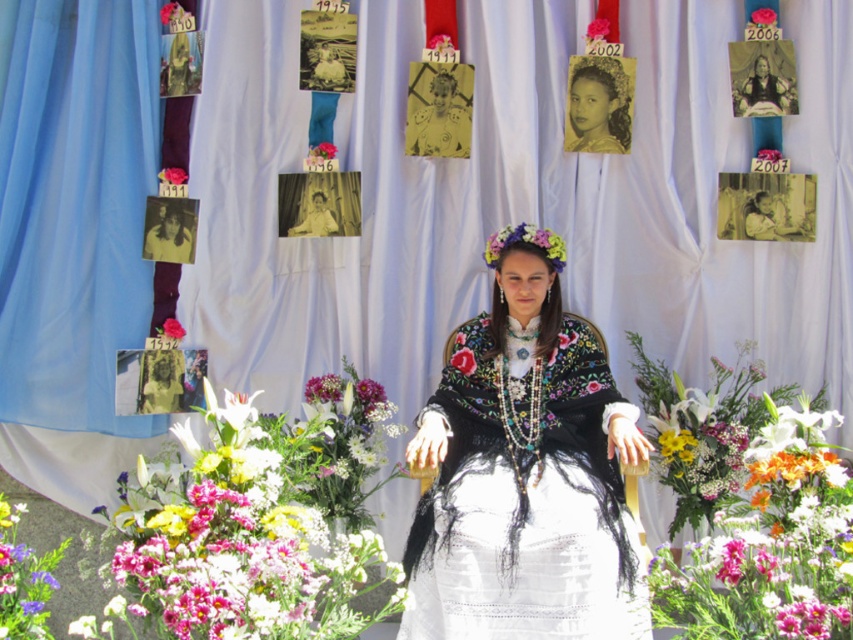
Can you confirm if embroidered velvet dress at center is positioned below pink fabric flower at center?

Indeed, embroidered velvet dress at center is positioned under pink fabric flower at center.

Can you confirm if embroidered velvet dress at center is positioned to the right of pink fabric flower at center?

Indeed, embroidered velvet dress at center is positioned on the right side of pink fabric flower at center.

The height and width of the screenshot is (640, 853). I want to click on embroidered velvet dress at center, so click(524, 470).

This screenshot has width=853, height=640. Find the location of `embroidered velvet dress at center`. embroidered velvet dress at center is located at coordinates 524,470.

Can you confirm if embroidered velvet dress at center is bigger than vibrant bouquet of flowers at center?

No, embroidered velvet dress at center is not bigger than vibrant bouquet of flowers at center.

Does embroidered velvet dress at center have a greater width compared to vibrant bouquet of flowers at center?

Incorrect, embroidered velvet dress at center's width does not surpass vibrant bouquet of flowers at center's.

Is point (413, 522) positioned before point (825, 595)?

No, it is behind (825, 595).

You are a GUI agent. You are given a task and a screenshot of the screen. Output one action in this format:
    pyautogui.click(x=<x>, y=<y>)
    Task: Click on the embroidered velvet dress at center
    
    Given the screenshot: What is the action you would take?
    pyautogui.click(x=524, y=470)

This screenshot has width=853, height=640. Describe the element at coordinates (524, 470) in the screenshot. I see `embroidered velvet dress at center` at that location.

Can you confirm if embroidered velvet dress at center is thinner than fluffy bouquet of flowers at center?

Correct, embroidered velvet dress at center's width is less than fluffy bouquet of flowers at center's.

Where is `embroidered velvet dress at center`? This screenshot has width=853, height=640. embroidered velvet dress at center is located at coordinates (524, 470).